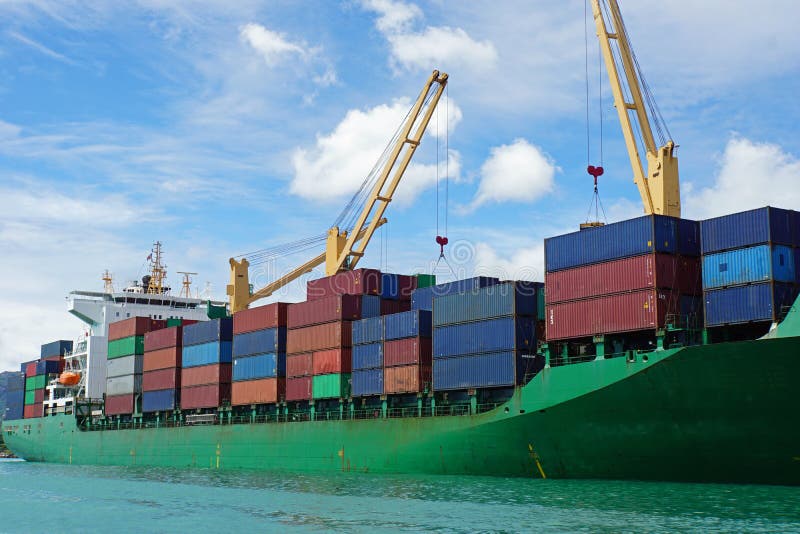
At what (x,y) coordinates should I click in order to perform the action: click on windows in ship's bridge. Please return your answer as a coordinate pair (x, y). Looking at the image, I should click on (118, 299), (130, 299), (141, 301), (165, 301), (172, 305), (178, 304), (189, 306).